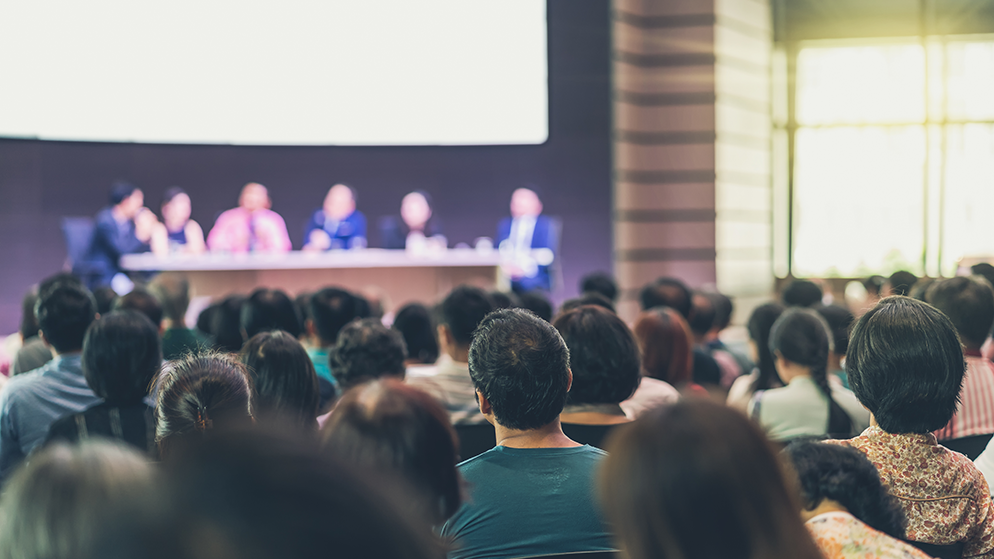
Find the location of a particular element. Image resolution: width=994 pixels, height=559 pixels. windows is located at coordinates click(876, 79), click(886, 156), click(963, 169), click(962, 75).